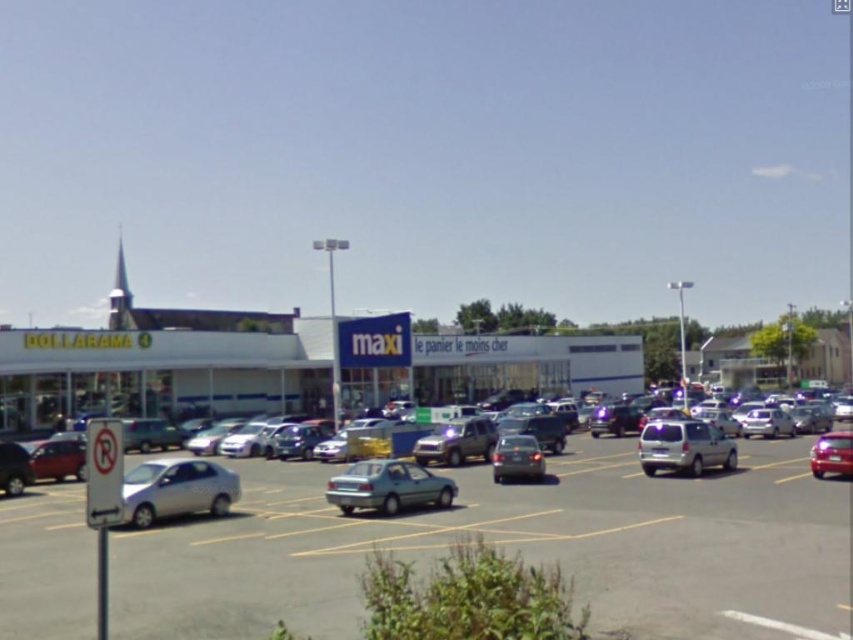
Which of these two, metallic silver suv at center or shiny red car at right, stands taller?

Standing taller between the two is shiny red car at right.

Does point (422, 464) lie in front of point (846, 449)?

No, it is not.

Is point (442, 445) more distant than point (844, 468)?

Yes, point (442, 445) is farther from viewer.

Identify the location of metallic silver suv at center. (456, 442).

Between silver metallic car at lower left and green matte sedan at center, which one has more height?

silver metallic car at lower left is taller.

Image resolution: width=853 pixels, height=640 pixels. What are the coordinates of `silver metallic car at lower left` in the screenshot? It's located at (177, 490).

At what (x,y) coordinates should I click in order to perform the action: click on silver metallic car at lower left. Please return your answer as a coordinate pair (x, y). The width and height of the screenshot is (853, 640). Looking at the image, I should click on (177, 490).

Can you confirm if green matte sedan at center is thinner than metallic silver suv at center?

Yes, green matte sedan at center is thinner than metallic silver suv at center.

Can you confirm if green matte sedan at center is positioned to the right of metallic silver suv at center?

Indeed, green matte sedan at center is positioned on the right side of metallic silver suv at center.

Who is more distant from viewer, (352, 484) or (476, 426)?

Point (476, 426)

I want to click on green matte sedan at center, so click(x=387, y=486).